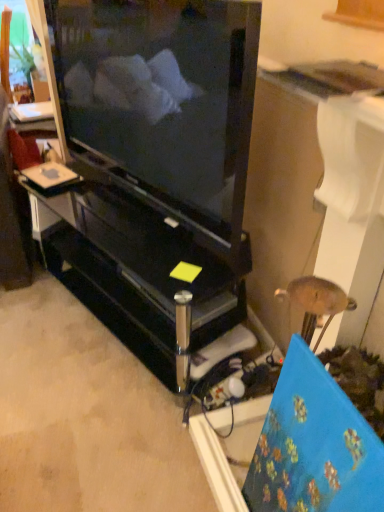
I want to click on empty space that is ontop of black glossy entertainment center at center (from a real-world perspective), so click(143, 234).